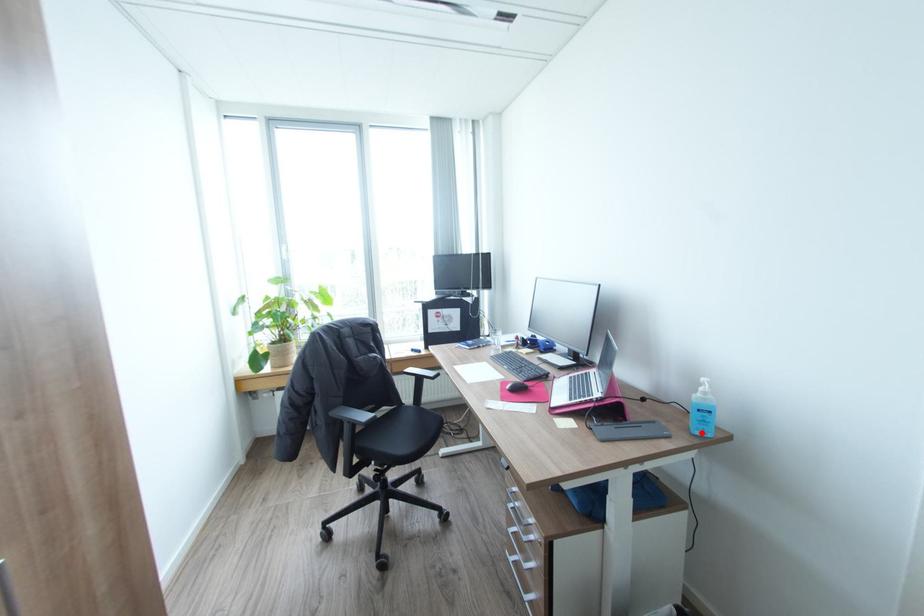
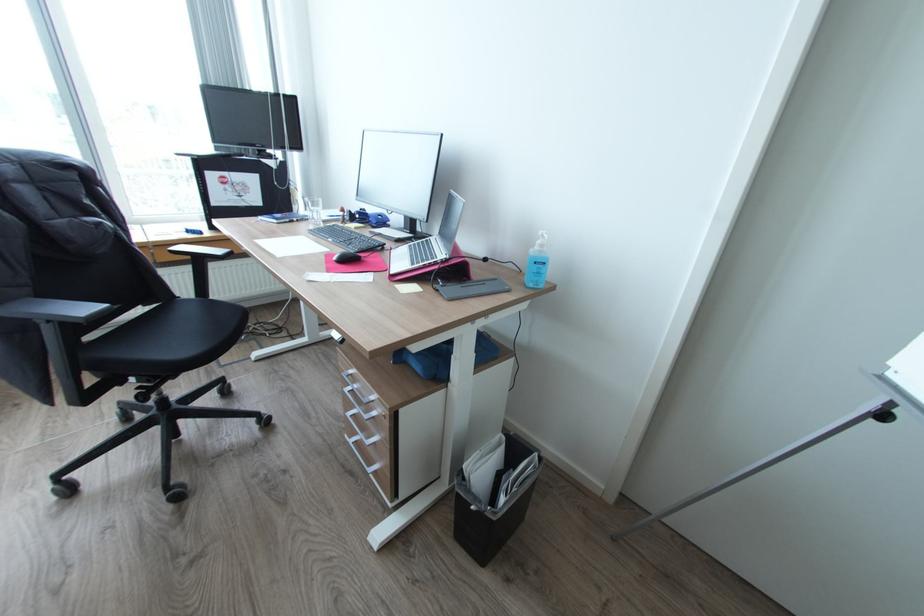
The point at the highlighted location is marked in the first image. Where is the corresponding point in the second image?

(536, 284)